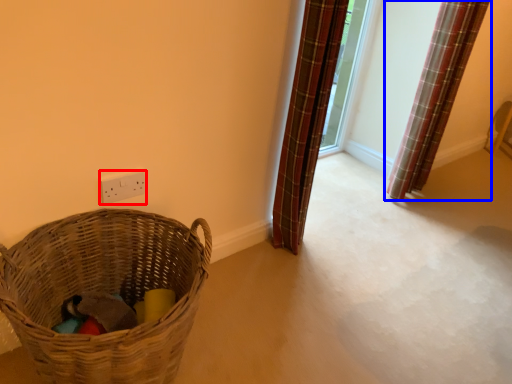
Question: Among these objects, which one is nearest to the camera, electric outlet (highlighted by a red box) or curtain (highlighted by a blue box)?

Choices:
 (A) electric outlet
 (B) curtain

Answer: (A)